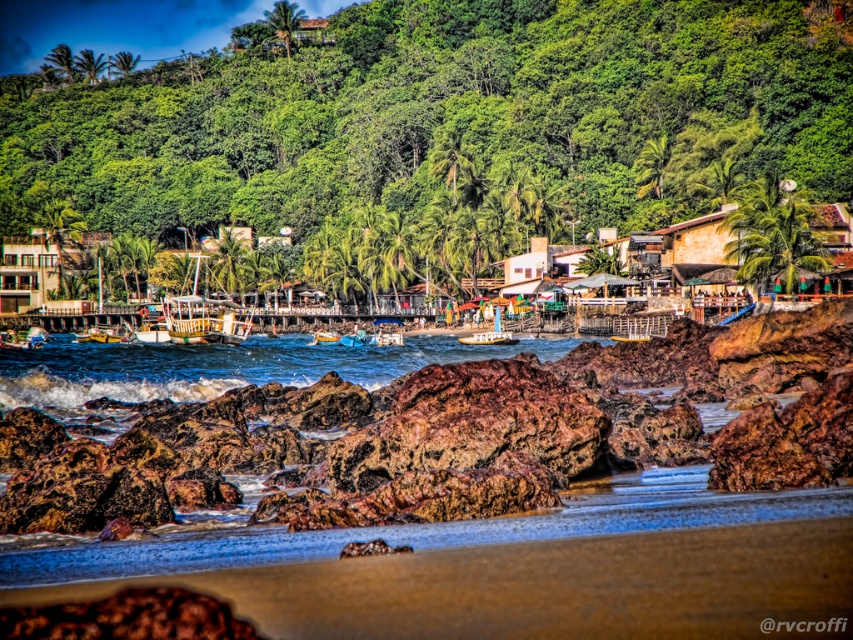
Based on the photo, you are a photographer positioned on the beach and want to capture both the metallic silver boat at lower left and the metallic blue boat at center in a single shot. Which boat should you position closer to the front of your camera frame to ensure both are visible?

You should position the metallic silver boat at lower left closer to the front of your camera frame because it is already in front of the metallic blue boat at center, ensuring both will be visible in the shot.